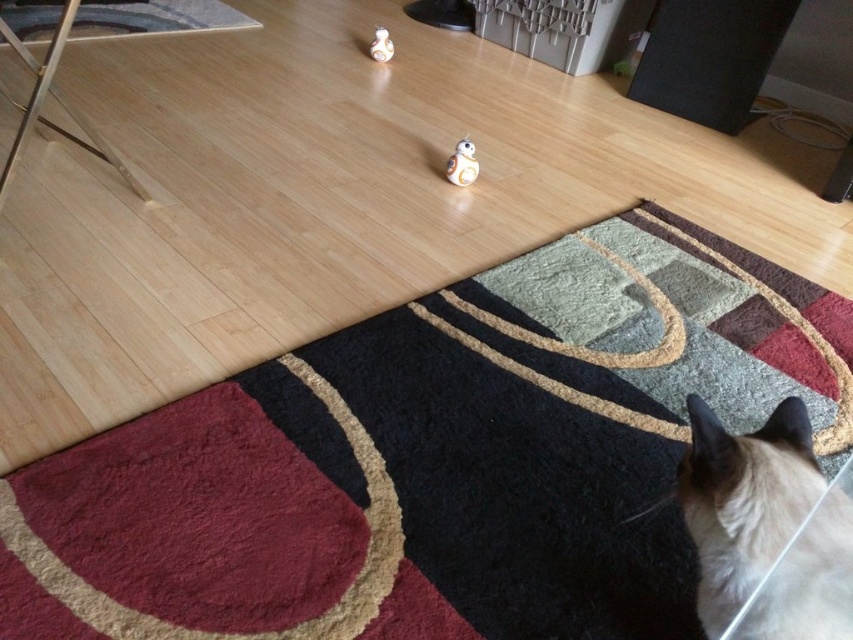
You are standing in the room and want to reach a specific point marked at coordinates point (759,528). If your arm can extend 30 inches forward, can you reach that point without moving your feet?

The distance of point (759,528) from viewer is 32.51 inches, so your arm cannot reach it since it requires extending 32.51 inches but your arm can only extend 30 inches.

You are standing in the room and want to step onto the closest object between the textured wool mat at lower center and the black textured rug at upper left. Which one should you choose?

The textured wool mat at lower center is closer to the viewer, so you should choose it to step onto.

You are a visitor in this room and want to pet the silky white cat at lower right without disturbing the white plastic bb8 at center. Which one is nearer to you so you can reach it first?

The silky white cat at lower right is closer to the viewer than the white plastic bb8 at center, so you can reach it first without disturbing the bb8.